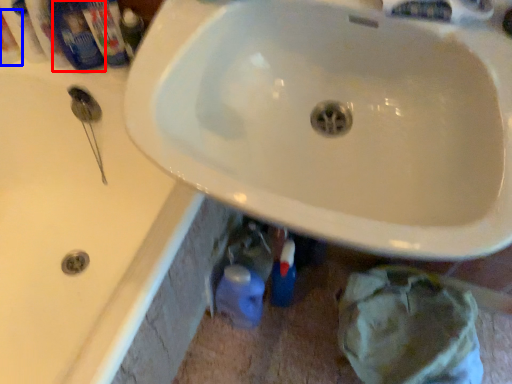
Question: Which point is closer to the camera, mouthwash (highlighted by a red box) or mouthwash (highlighted by a blue box)?

Choices:
 (A) mouthwash
 (B) mouthwash

Answer: (B)